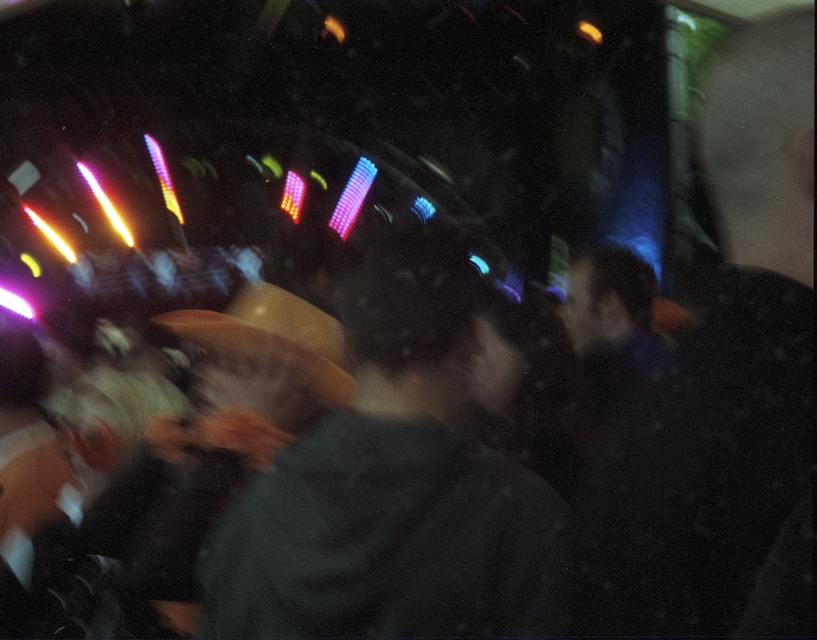
Question: Which point is closer to the camera taking this photo?

Choices:
 (A) (628, 531)
 (B) (261, 531)

Answer: (A)

Question: Is dark gray shirt at right below dark gray sweater at center?

Choices:
 (A) no
 (B) yes

Answer: (A)

Question: Can you confirm if dark gray shirt at right is positioned above dark gray sweater at center?

Choices:
 (A) no
 (B) yes

Answer: (B)

Question: Which point appears closest to the camera in this image?

Choices:
 (A) (315, 528)
 (B) (807, 410)

Answer: (B)

Question: Is dark gray shirt at right further to the viewer compared to dark gray sweater at center?

Choices:
 (A) yes
 (B) no

Answer: (B)